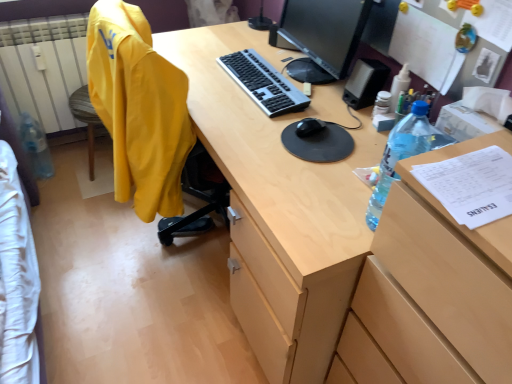
The height and width of the screenshot is (384, 512). I want to click on free location to the right of black matte mouse at center, so click(352, 127).